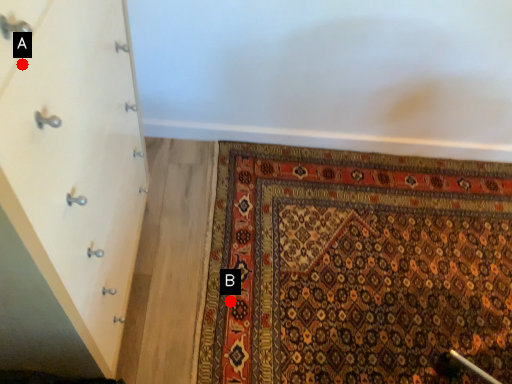
Question: Two points are circled on the image, labeled by A and B beside each circle. Which point is closer to the camera?

Choices:
 (A) A is closer
 (B) B is closer

Answer: (A)